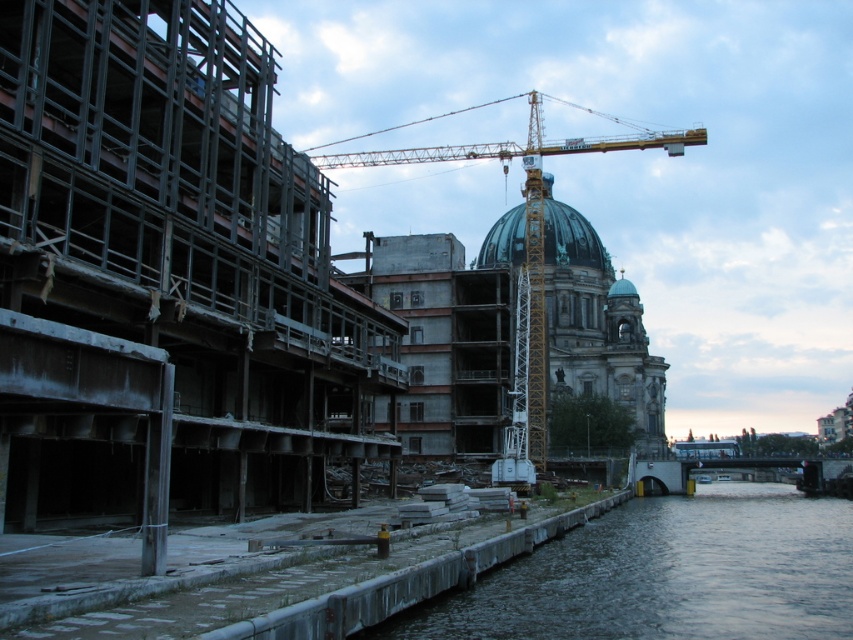
Question: Which point is farther to the camera?

Choices:
 (A) dark gray concrete at lower left
 (B) yellow metallic crane at center
 (C) green glass dome at center

Answer: (C)

Question: Which of the following is the farthest from the observer?

Choices:
 (A) (670, 604)
 (B) (527, 412)
 (C) (558, 252)

Answer: (C)

Question: Does dark gray concrete at lower left appear on the right side of green glass dome at center?

Choices:
 (A) yes
 (B) no

Answer: (A)

Question: Can you confirm if dark gray concrete at lower left is wider than green glass dome at center?

Choices:
 (A) no
 (B) yes

Answer: (B)

Question: From the image, what is the correct spatial relationship of yellow metallic crane at center in relation to green glass dome at center?

Choices:
 (A) below
 (B) above

Answer: (B)

Question: Which object is positioned farthest from the yellow metallic crane at center?

Choices:
 (A) dark gray concrete at lower left
 (B) green glass dome at center

Answer: (A)